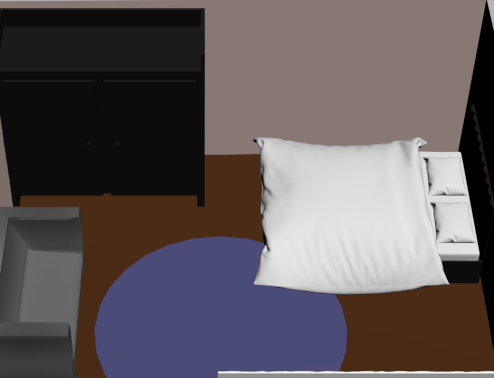
Locate an element on the screen. This screenshot has width=494, height=378. arms of couch is located at coordinates (32, 332), (53, 215).